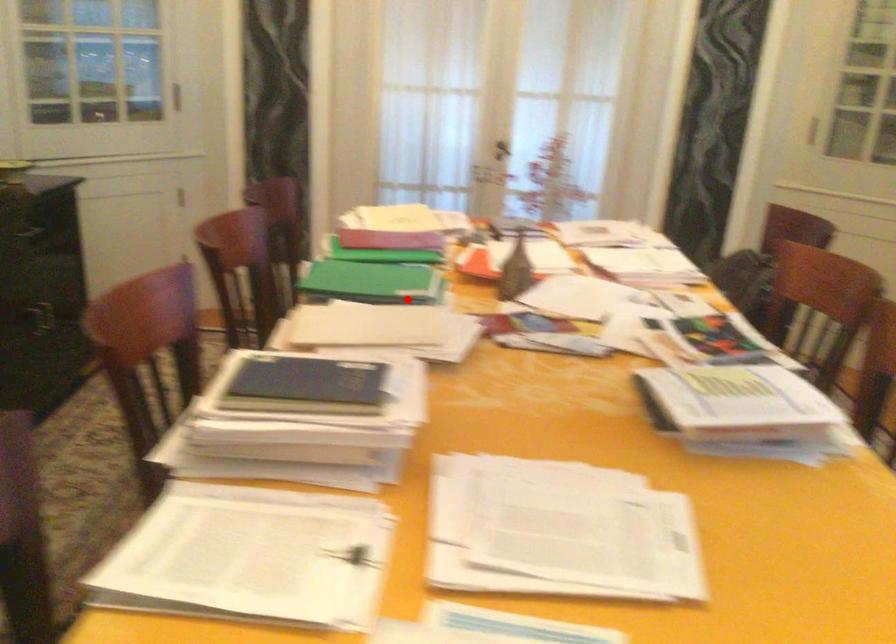
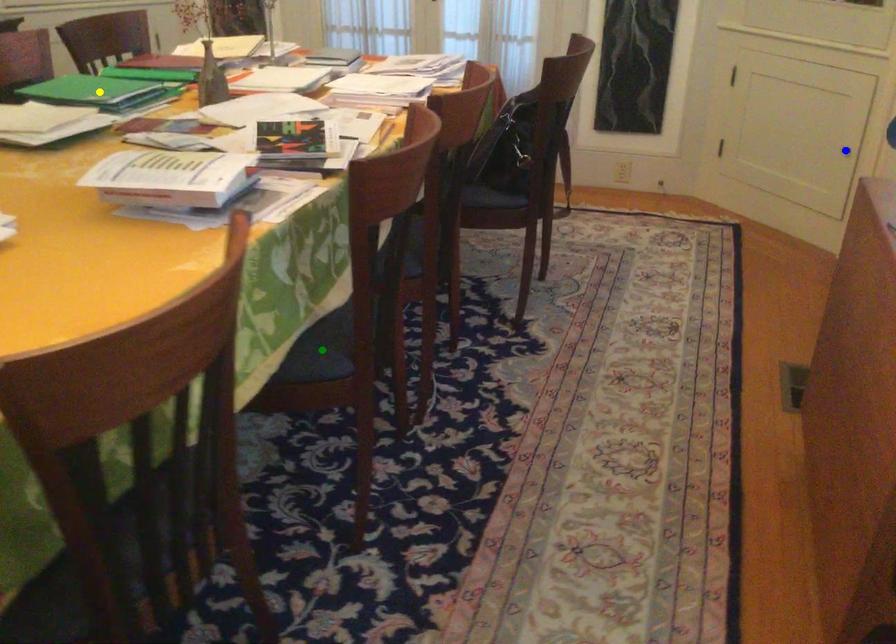
Question: I am providing you with two images of the same scene from different viewpoints. A red point is marked on the first image. You are given multiple points on the second image. Which mark in image 2 goes with the point in image 1?

Choices:
 (A) yellow point
 (B) blue point
 (C) green point

Answer: (A)